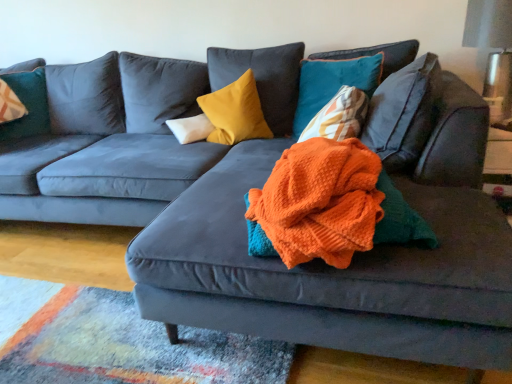
Question: Is white soft pillow at center, which is counted as the 3th pillow, starting from the right, in front of or behind teal velvet pillow at upper right, positioned as the 4th pillow in left-to-right order, in the image?

Choices:
 (A) behind
 (B) front

Answer: (A)

Question: In terms of width, does white soft pillow at center, which is counted as the 3th pillow, starting from the right, look wider or thinner when compared to teal velvet pillow at upper right, the first pillow when ordered from right to left?

Choices:
 (A) wide
 (B) thin

Answer: (A)

Question: Estimate the real-world distances between objects in this image. Which object is farther from the velvet yellow pillow at center, the 3th pillow in the left-to-right sequence?

Choices:
 (A) velvet teal pillow at upper left, which is the fourth pillow in right-to-left order
 (B) orange knitted blanket at center
 (C) white soft pillow at center, which is counted as the 3th pillow, starting from the right
 (D) teal velvet pillow at upper right, positioned as the 4th pillow in left-to-right order

Answer: (A)

Question: Which object is positioned closest to the orange knitted blanket at center?

Choices:
 (A) teal velvet pillow at upper right, positioned as the 4th pillow in left-to-right order
 (B) velvet teal pillow at upper left, which is the fourth pillow in right-to-left order
 (C) white soft pillow at center, which is counted as the 3th pillow, starting from the right
 (D) velvet yellow pillow at center, which appears as the second pillow when viewed from the right

Answer: (A)